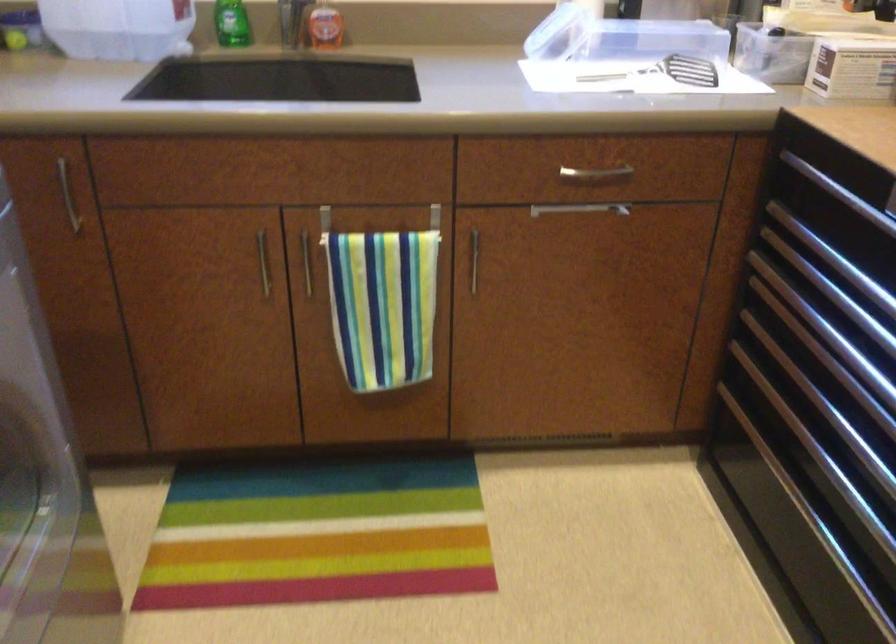
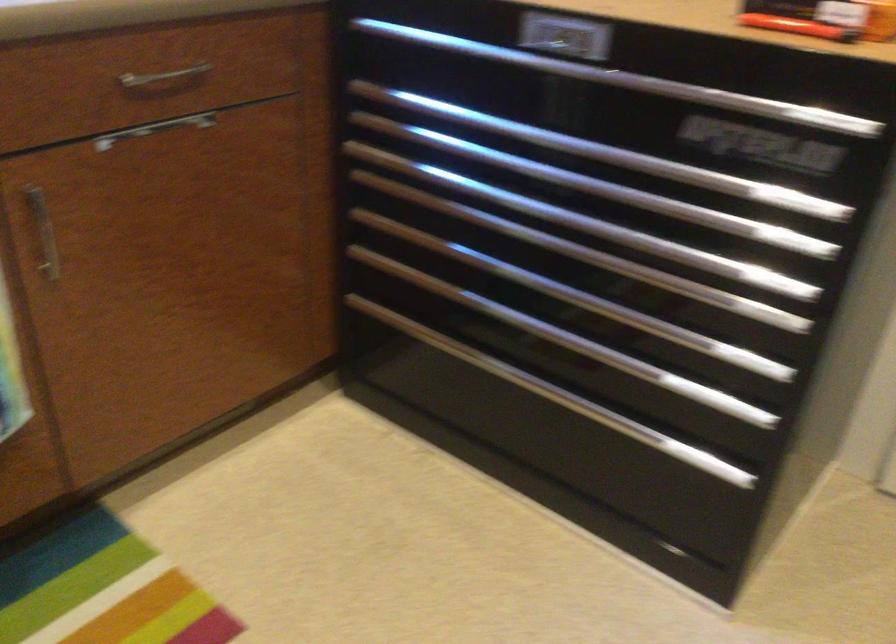
Question: The camera is either moving clockwise (left) or counter-clockwise (right) around the object. The first image is from the beginning of the video and the second image is from the end. Is the camera moving left or right when shooting the video?

Choices:
 (A) Left
 (B) Right

Answer: (A)